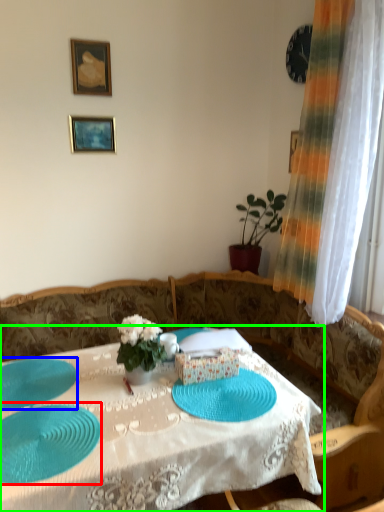
Question: Based on their relative distances, which object is nearer to glass plate (highlighted by a red box)? Choose from glass plate (highlighted by a blue box) and table (highlighted by a green box).

Choices:
 (A) glass plate
 (B) table

Answer: (A)